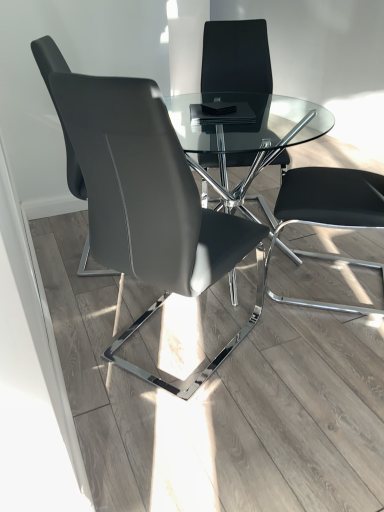
Locate an element on the screen. This screenshot has width=384, height=512. free space in front of matte black chair at center, positioned as the third chair in back-to-front order is located at coordinates (200, 434).